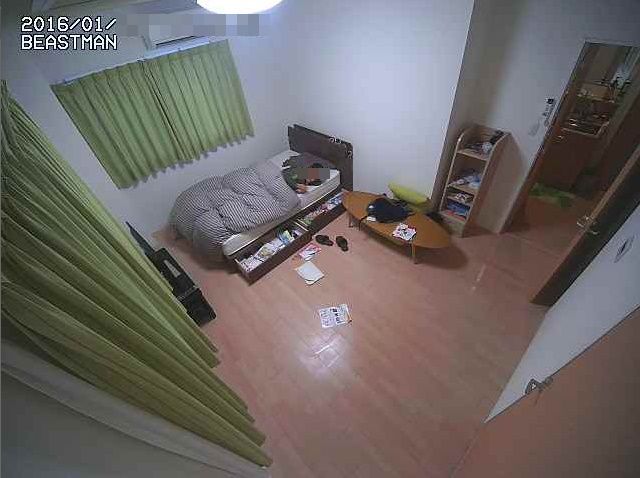
Find the location of `black and white striped comforter`. black and white striped comforter is located at coordinates (230, 193).